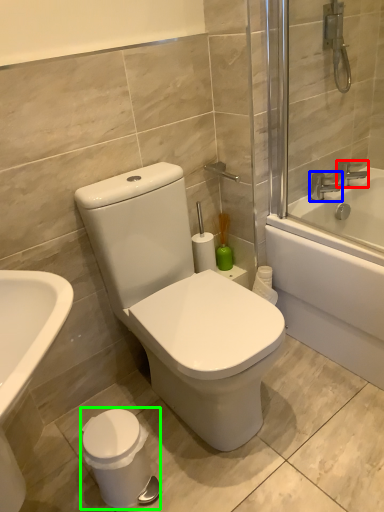
Question: Based on their relative distances, which object is farther from tap (highlighted by a red box)? Choose from tap (highlighted by a blue box) and porcelain (highlighted by a green box).

Choices:
 (A) tap
 (B) porcelain

Answer: (B)